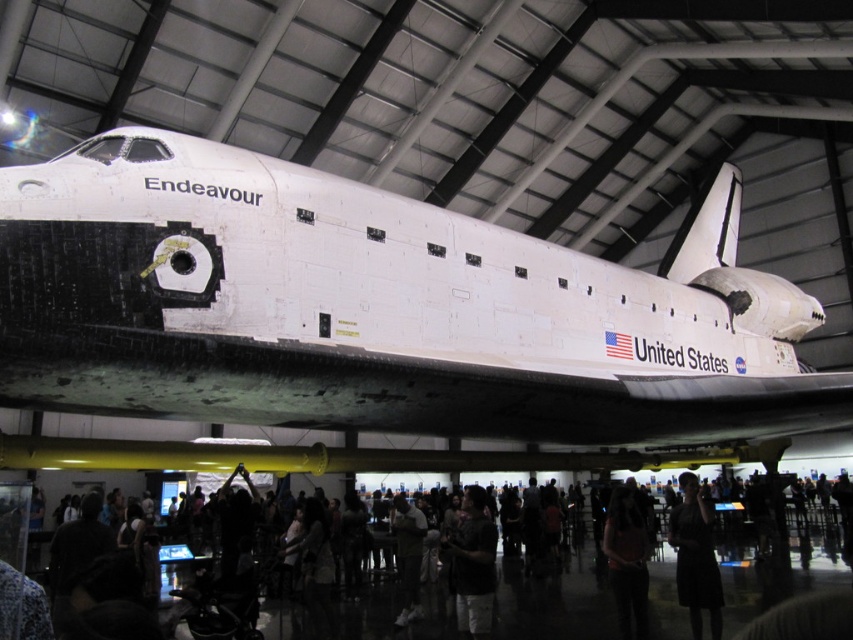
Question: Which is farther from the dark clothing crowd at lower center?

Choices:
 (A) black dress at lower right
 (B) matte pink shirt at center
 (C) dark gray fabric shirt at center

Answer: (B)

Question: Can you confirm if white matte space shuttle at center is positioned above matte pink shirt at center?

Choices:
 (A) yes
 (B) no

Answer: (A)

Question: Is the position of black dress at lower right more distant than that of matte pink shirt at center?

Choices:
 (A) no
 (B) yes

Answer: (A)

Question: Which point is farther from the camera taking this photo?

Choices:
 (A) (459, 524)
 (B) (714, 428)

Answer: (A)

Question: Where is black dress at lower right located in relation to dark gray fabric shirt at center in the image?

Choices:
 (A) above
 (B) below

Answer: (A)

Question: Which point appears farthest from the camera in this image?

Choices:
 (A) (476, 518)
 (B) (341, 612)

Answer: (B)